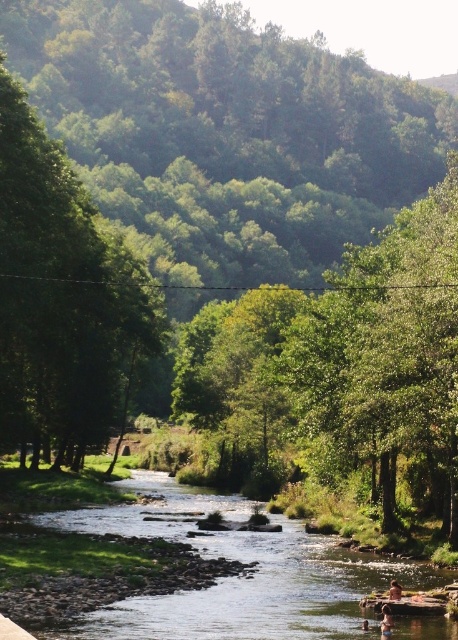
Question: Observing the image, what is the correct spatial positioning of clear water stream at center in reference to tan skin person at river center?

Choices:
 (A) above
 (B) below

Answer: (B)

Question: Which object is closer to the camera taking this photo?

Choices:
 (A) smooth skin person at lower right
 (B) clear water stream at center
 (C) tan skin person at river center

Answer: (B)

Question: Which of the following is the closest to the observer?

Choices:
 (A) (136, 632)
 (B) (392, 593)
 (C) (382, 624)

Answer: (A)

Question: Among these objects, which one is nearest to the camera?

Choices:
 (A) clear water stream at center
 (B) smooth skin person at lower right

Answer: (A)

Question: Does tan skin person at river center appear over smooth skin person at lower right?

Choices:
 (A) no
 (B) yes

Answer: (B)

Question: Can you confirm if clear water stream at center is positioned above smooth skin person at lower right?

Choices:
 (A) yes
 (B) no

Answer: (B)